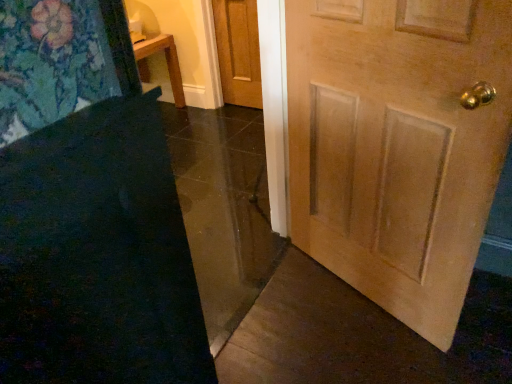
Question: From a real-world perspective, is dark blue carpet at lower left located higher than light brown wood door at center, marked as the first door in a right-to-left arrangement?

Choices:
 (A) no
 (B) yes

Answer: (A)

Question: Would you say dark blue carpet at lower left is outside light brown wood door at center, marked as the second door in a top-to-bottom arrangement?

Choices:
 (A) no
 (B) yes

Answer: (B)

Question: Is the position of dark blue carpet at lower left less distant than that of light brown wood door at center, marked as the second door in a top-to-bottom arrangement?

Choices:
 (A) yes
 (B) no

Answer: (A)

Question: From a real-world perspective, is dark blue carpet at lower left under light brown wood door at center, the 2th door viewed from the back?

Choices:
 (A) no
 (B) yes

Answer: (B)

Question: Are dark blue carpet at lower left and light brown wood door at center, which ranks as the 1th door in bottom-to-top order, beside each other?

Choices:
 (A) yes
 (B) no

Answer: (B)

Question: Is light brown wood door at center, the 2th door viewed from the back, in front of or behind light brown wood door at center, the 1th door from the top, in the image?

Choices:
 (A) behind
 (B) front

Answer: (B)

Question: Is light brown wood door at center, the 2th door viewed from the back, wider or thinner than light brown wood door at center, which is the second door from right to left?

Choices:
 (A) wide
 (B) thin

Answer: (A)

Question: From a real-world perspective, relative to light brown wood door at center, the first door when ordered from left to right, is light brown wood door at center, marked as the second door in a top-to-bottom arrangement, vertically above or below?

Choices:
 (A) above
 (B) below

Answer: (A)

Question: Considering the positions of point click(294, 241) and point click(262, 107), is point click(294, 241) closer or farther from the camera than point click(262, 107)?

Choices:
 (A) farther
 (B) closer

Answer: (B)

Question: From a real-world perspective, relative to dark blue carpet at lower left, is light brown wood door at center, which ranks as the 2th door in front-to-back order, vertically above or below?

Choices:
 (A) above
 (B) below

Answer: (B)

Question: Looking at their shapes, would you say light brown wood door at center, the 2th door in the bottom-to-top sequence, is wider or thinner than dark blue carpet at lower left?

Choices:
 (A) wide
 (B) thin

Answer: (A)

Question: In the image, is light brown wood door at center, the 1th door from the top, on the left side or the right side of dark blue carpet at lower left?

Choices:
 (A) left
 (B) right

Answer: (B)

Question: Is light brown wood door at center, the 1th door from the back, spatially inside dark blue carpet at lower left, or outside of it?

Choices:
 (A) inside
 (B) outside

Answer: (B)

Question: Is light brown wood door at center, which ranks as the 1th door in bottom-to-top order, wider or thinner than dark blue carpet at lower left?

Choices:
 (A) wide
 (B) thin

Answer: (A)

Question: In terms of size, does light brown wood door at center, which ranks as the 1th door in front-to-back order, appear bigger or smaller than dark blue carpet at lower left?

Choices:
 (A) big
 (B) small

Answer: (A)